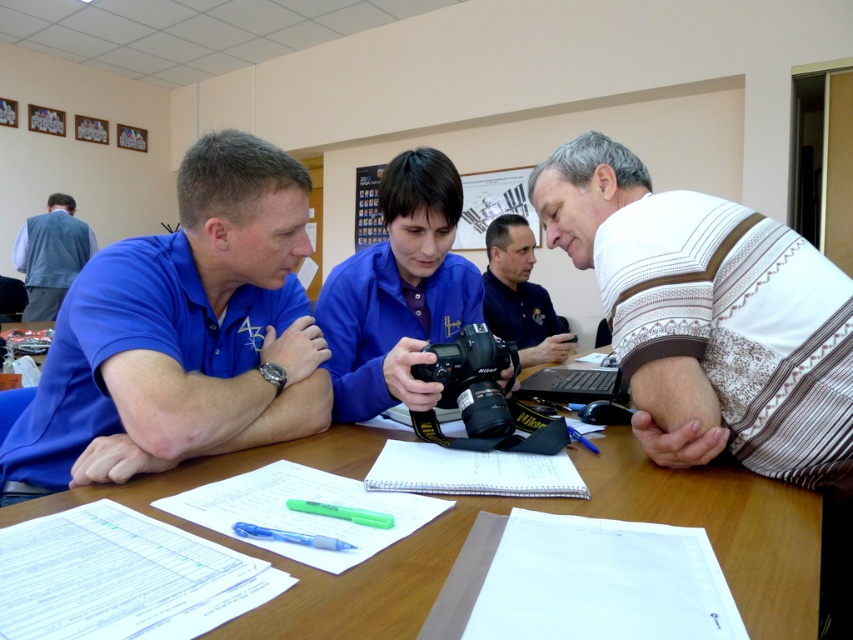
Consider the image. You are standing in the office and want to place a small plant between the two points marked as point (192, 310) and point (392, 324). Which point should the plant be closer to in order to be nearer to the viewer?

The plant should be placed closer to point (192, 310) because it is closer to the viewer than point (392, 324).

You are a photographer preparing to take a group photo of the people around the table. You need to ensure that both the light blue denim vest at upper left and the translucent blue pen at lower left are clearly visible in the photo. Which object should you focus on first to ensure both are in focus?

The light blue denim vest at upper left is further to the viewer than the translucent blue pen at lower left. To ensure both are in focus, you should focus on the light blue denim vest at upper left first, as it is closer to the camera and adjusting focus from there will help capture the pen in the background.